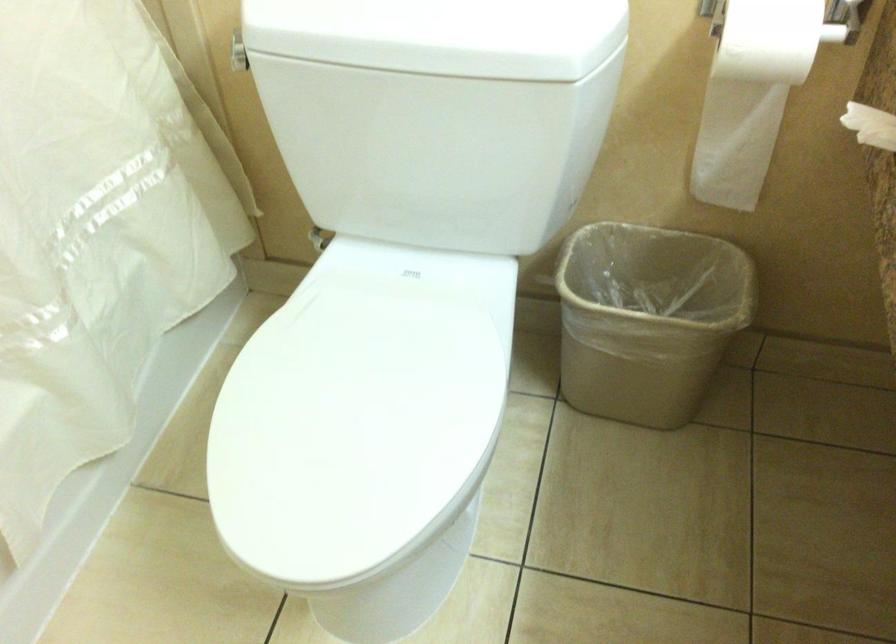
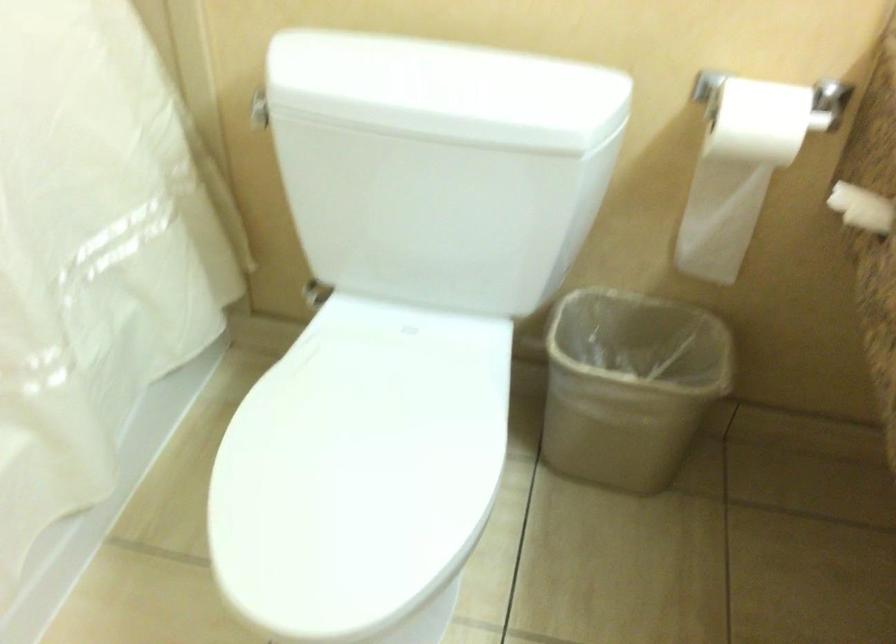
Find the pixel in the second image that matches pixel 755 79 in the first image.

(744, 162)